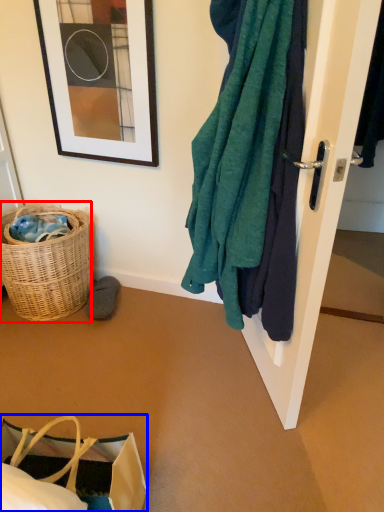
Question: Which point is closer to the camera, picnic basket (highlighted by a red box) or handbag (highlighted by a blue box)?

Choices:
 (A) picnic basket
 (B) handbag

Answer: (B)